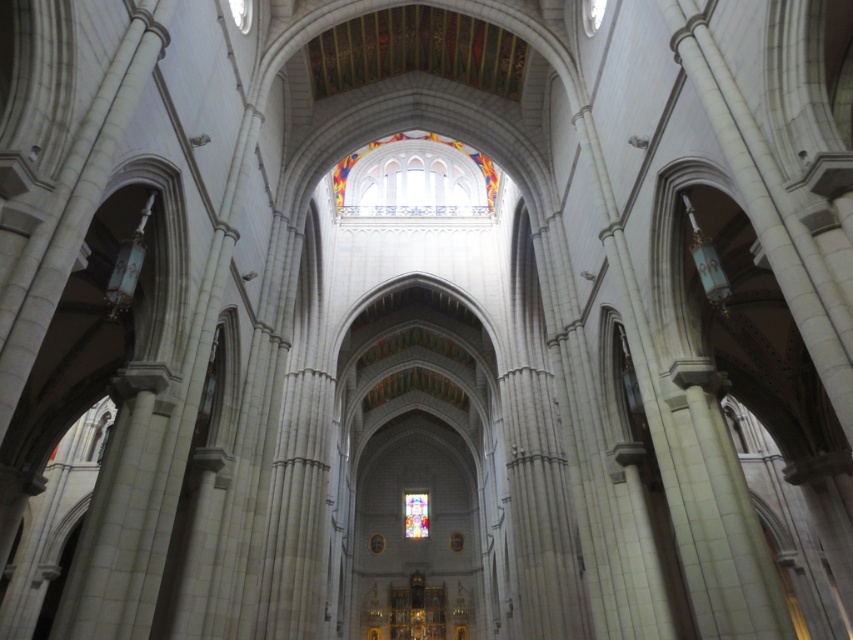
Question: Can you confirm if stained glass window at center is positioned to the right of translucent stained glass at center?

Choices:
 (A) no
 (B) yes

Answer: (B)

Question: Is stained glass window at center positioned before translucent stained glass at center?

Choices:
 (A) yes
 (B) no

Answer: (A)

Question: Which object appears farthest from the camera in this image?

Choices:
 (A) stained glass window at center
 (B) translucent stained glass at center

Answer: (B)

Question: Does stained glass window at center have a greater width compared to translucent stained glass at center?

Choices:
 (A) yes
 (B) no

Answer: (A)